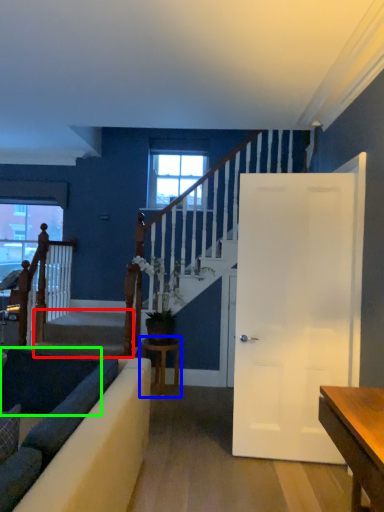
Question: Which is nearer to the stairwell (highlighted by a red box)? table (highlighted by a blue box) or dark (highlighted by a green box).

Choices:
 (A) table
 (B) dark

Answer: (A)